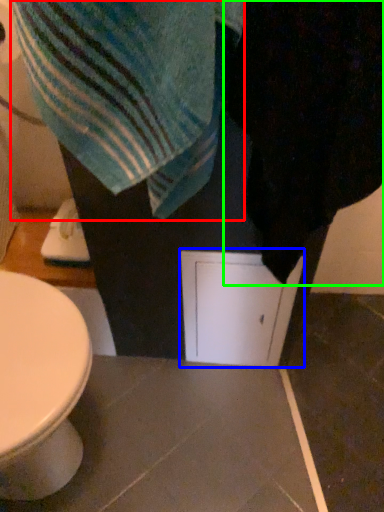
Question: Which object is positioned farthest from beach towel (highlighted by a red box)? Select from screen door (highlighted by a blue box) and bath towel (highlighted by a green box).

Choices:
 (A) screen door
 (B) bath towel

Answer: (A)